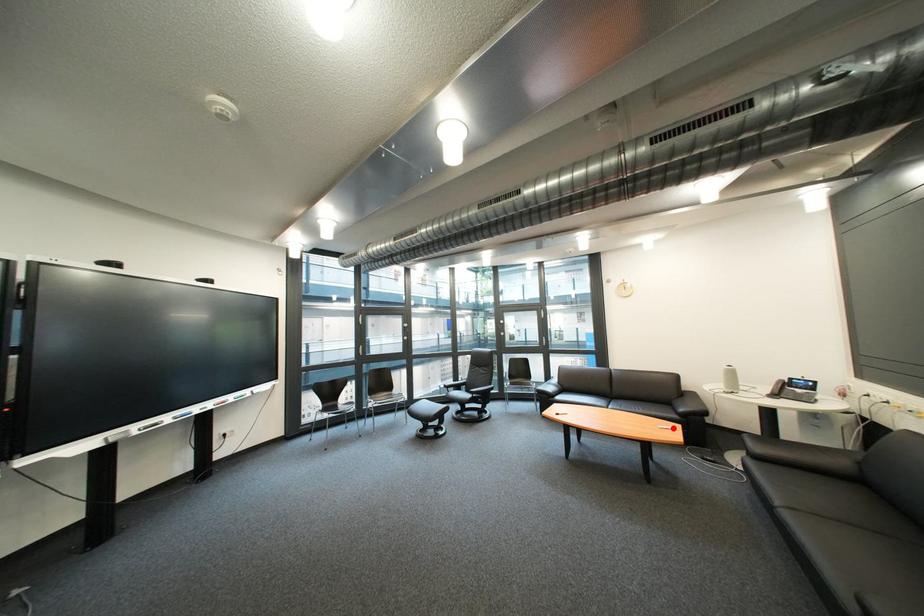
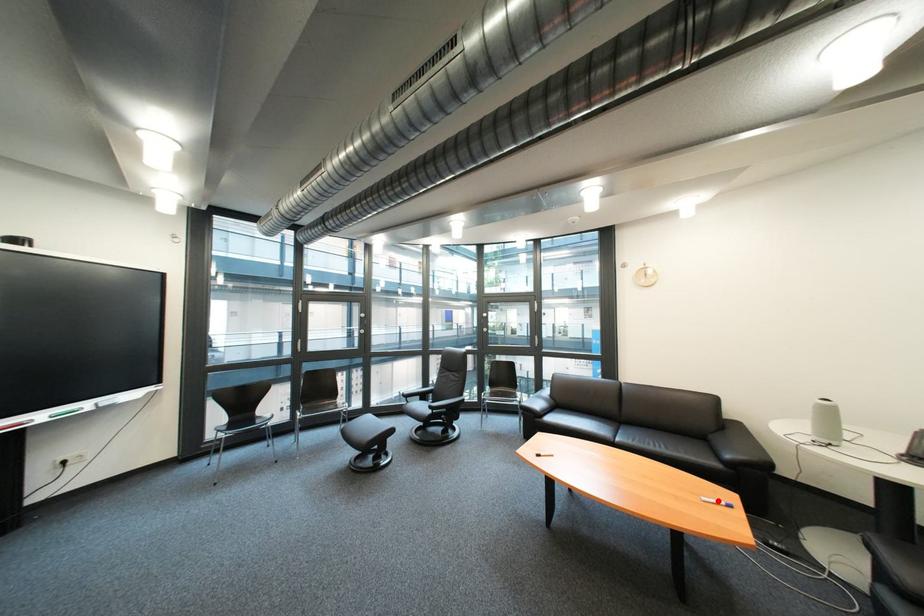
I am providing you with two images of the same scene from different viewpoints. A red point is marked on the first image and another point is marked on the second image. Is the red point in image1 aligned with the point shown in image2?

Yes